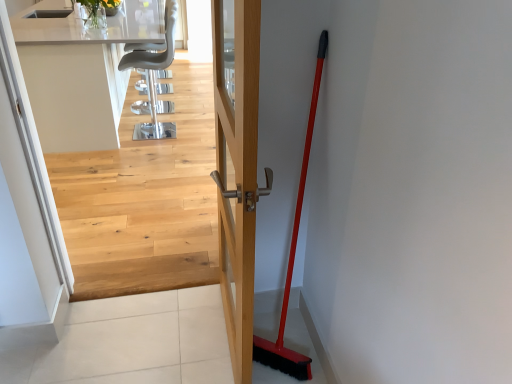
Question: From a real-world perspective, is metallic gray chair at upper center on light wood floor at upper center?

Choices:
 (A) no
 (B) yes

Answer: (A)

Question: Would you consider metallic gray chair at upper center to be distant from light wood floor at upper center?

Choices:
 (A) yes
 (B) no

Answer: (B)

Question: Is metallic gray chair at upper center taller than light wood floor at upper center?

Choices:
 (A) no
 (B) yes

Answer: (A)

Question: From the image's perspective, does metallic gray chair at upper center appear higher than light wood floor at upper center?

Choices:
 (A) no
 (B) yes

Answer: (B)

Question: Does metallic gray chair at upper center have a greater width compared to light wood floor at upper center?

Choices:
 (A) yes
 (B) no

Answer: (A)

Question: Looking at the image, does wooden door handle at center seem bigger or smaller compared to metallic gray chair at upper center?

Choices:
 (A) small
 (B) big

Answer: (A)

Question: In the image, is wooden door handle at center positioned in front of or behind metallic gray chair at upper center?

Choices:
 (A) behind
 (B) front

Answer: (B)

Question: Does point (230, 185) appear closer or farther from the camera than point (121, 67)?

Choices:
 (A) farther
 (B) closer

Answer: (B)

Question: From the image's perspective, is wooden door handle at center located above or below metallic gray chair at upper center?

Choices:
 (A) below
 (B) above

Answer: (A)

Question: Is light wood floor at upper center in front of or behind red plastic shovel at right in the image?

Choices:
 (A) behind
 (B) front

Answer: (A)

Question: Does point (214, 221) appear closer or farther from the camera than point (307, 129)?

Choices:
 (A) farther
 (B) closer

Answer: (A)

Question: Choose the correct answer: Is light wood floor at upper center inside red plastic shovel at right or outside it?

Choices:
 (A) outside
 (B) inside

Answer: (A)

Question: In terms of size, does light wood floor at upper center appear bigger or smaller than red plastic shovel at right?

Choices:
 (A) small
 (B) big

Answer: (B)

Question: Looking at their shapes, would you say wooden door handle at center is wider or thinner than red plastic shovel at right?

Choices:
 (A) thin
 (B) wide

Answer: (B)

Question: In the image, is wooden door handle at center positioned in front of or behind red plastic shovel at right?

Choices:
 (A) front
 (B) behind

Answer: (A)